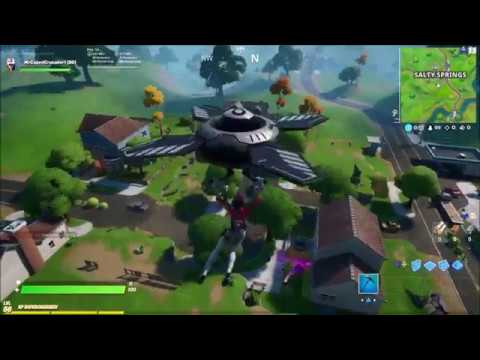
Find the location of a particular element. map is located at coordinates (442, 105).